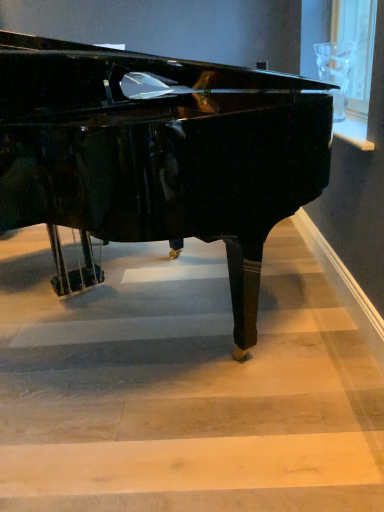
Question: Should I look upward or downward to see transparent glass at upper right?

Choices:
 (A) up
 (B) down

Answer: (A)

Question: Does glossy black piano at center come in front of wooden stairwell at center?

Choices:
 (A) no
 (B) yes

Answer: (B)

Question: Could you tell me if glossy black piano at center is turned towards wooden stairwell at center?

Choices:
 (A) no
 (B) yes

Answer: (A)

Question: Can you confirm if glossy black piano at center is thinner than wooden stairwell at center?

Choices:
 (A) no
 (B) yes

Answer: (B)

Question: Considering the relative sizes of glossy black piano at center and wooden stairwell at center in the image provided, is glossy black piano at center wider than wooden stairwell at center?

Choices:
 (A) yes
 (B) no

Answer: (B)

Question: Considering the relative sizes of glossy black piano at center and wooden stairwell at center in the image provided, is glossy black piano at center shorter than wooden stairwell at center?

Choices:
 (A) yes
 (B) no

Answer: (B)

Question: Can you confirm if glossy black piano at center is smaller than wooden stairwell at center?

Choices:
 (A) no
 (B) yes

Answer: (A)

Question: Is transparent glass at upper right at the left side of wooden stairwell at center?

Choices:
 (A) yes
 (B) no

Answer: (B)

Question: Is transparent glass at upper right far away from wooden stairwell at center?

Choices:
 (A) yes
 (B) no

Answer: (A)

Question: Could you tell me if transparent glass at upper right is facing wooden stairwell at center?

Choices:
 (A) yes
 (B) no

Answer: (B)

Question: From a real-world perspective, is transparent glass at upper right below wooden stairwell at center?

Choices:
 (A) yes
 (B) no

Answer: (B)

Question: Can you confirm if transparent glass at upper right is wider than wooden stairwell at center?

Choices:
 (A) yes
 (B) no

Answer: (B)

Question: Does transparent glass at upper right come behind wooden stairwell at center?

Choices:
 (A) no
 (B) yes

Answer: (B)

Question: Does wooden stairwell at center have a lesser height compared to glossy black piano at center?

Choices:
 (A) no
 (B) yes

Answer: (B)